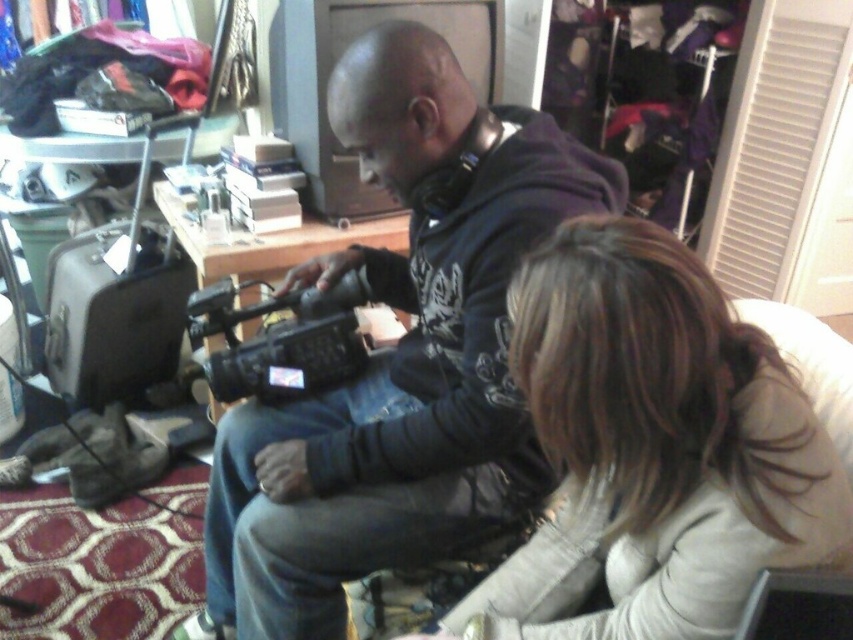
Question: Which point is closer to the camera?

Choices:
 (A) black plastic video camera at center
 (B) matte black camera at center

Answer: (B)

Question: Which is nearer to the black plastic video camera at center?

Choices:
 (A) matte black camera at center
 (B) smooth beige sweater at lower right

Answer: (A)

Question: Is matte black camera at center smaller than black plastic video camera at center?

Choices:
 (A) no
 (B) yes

Answer: (A)

Question: Is smooth beige sweater at lower right further to camera compared to black plastic video camera at center?

Choices:
 (A) no
 (B) yes

Answer: (A)

Question: Is smooth beige sweater at lower right above black plastic video camera at center?

Choices:
 (A) no
 (B) yes

Answer: (A)

Question: Estimate the real-world distances between objects in this image. Which object is closer to the smooth beige sweater at lower right?

Choices:
 (A) black plastic video camera at center
 (B) matte black camera at center

Answer: (B)